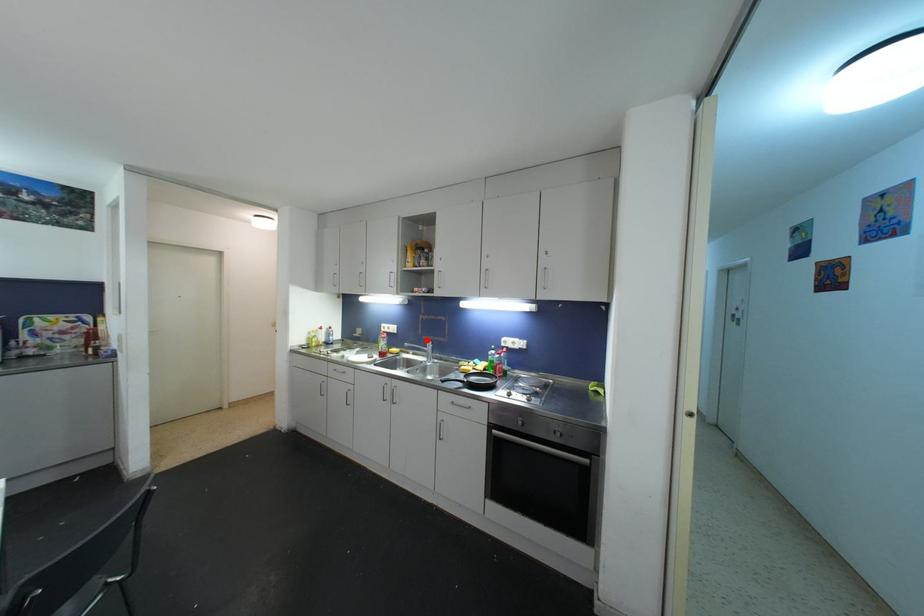
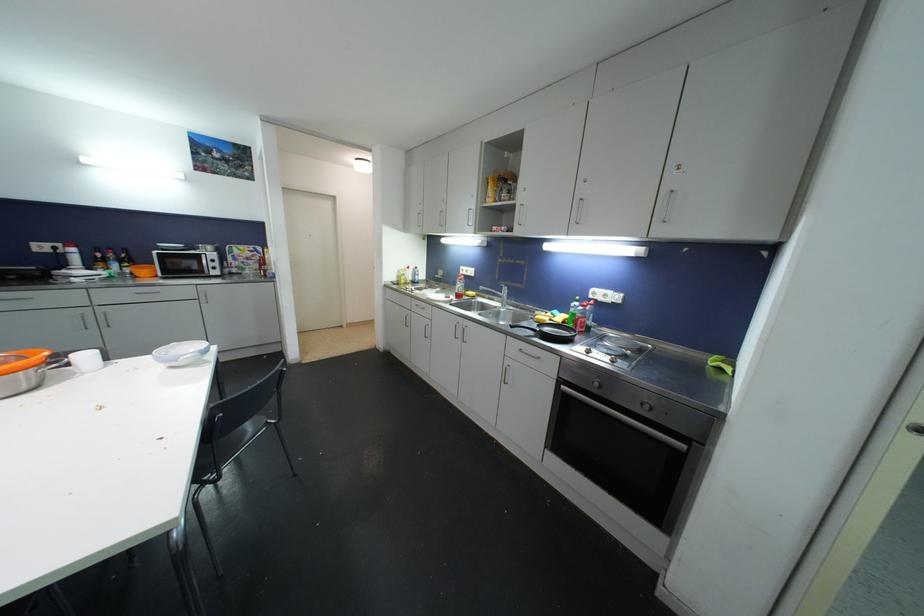
The point at the highlighted location is marked in the first image. Where is the corresponding point in the second image?

(504, 285)